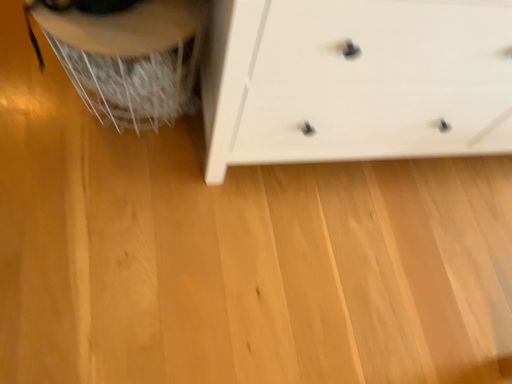
Locate an element on the screen. white matte chest of drawers at center is located at coordinates [355, 80].

Image resolution: width=512 pixels, height=384 pixels. Describe the element at coordinates (355, 80) in the screenshot. I see `white matte chest of drawers at center` at that location.

At what (x,y) coordinates should I click in order to perform the action: click on white plastic swivel chair at left. Please return your answer as a coordinate pair (x, y). Looking at the image, I should click on (x=127, y=55).

What do you see at coordinates (127, 55) in the screenshot?
I see `white plastic swivel chair at left` at bounding box center [127, 55].

Find the location of a particular element. white matte chest of drawers at center is located at coordinates (355, 80).

Which is more to the right, white plastic swivel chair at left or white matte chest of drawers at center?

From the viewer's perspective, white matte chest of drawers at center appears more on the right side.

Is white plastic swivel chair at left positioned before white matte chest of drawers at center?

No, white plastic swivel chair at left is behind white matte chest of drawers at center.

Is point (181, 45) positioned after point (404, 122)?

No.

From the image's perspective, relative to white matte chest of drawers at center, is white plastic swivel chair at left above or below?

Clearly, from the image's perspective, white plastic swivel chair at left is below white matte chest of drawers at center.

From a real-world perspective, is white plastic swivel chair at left above or below white matte chest of drawers at center?

white plastic swivel chair at left is situated lower than white matte chest of drawers at center in the real world.

Consider the image. Does white plastic swivel chair at left have a greater width compared to white matte chest of drawers at center?

In fact, white plastic swivel chair at left might be narrower than white matte chest of drawers at center.

Considering the sizes of white plastic swivel chair at left and white matte chest of drawers at center in the image, is white plastic swivel chair at left taller or shorter than white matte chest of drawers at center?

Clearly, white plastic swivel chair at left is shorter compared to white matte chest of drawers at center.

From the picture: Is white plastic swivel chair at left bigger than white matte chest of drawers at center?

No, white plastic swivel chair at left is not bigger than white matte chest of drawers at center.

Would you say white plastic swivel chair at left contains white matte chest of drawers at center?

No, white matte chest of drawers at center is not a part of white plastic swivel chair at left.

Is the surface of white plastic swivel chair at left in direct contact with white matte chest of drawers at center?

No, white plastic swivel chair at left is not with white matte chest of drawers at center.

Is white plastic swivel chair at left oriented away from white matte chest of drawers at center?

No.

What's the angular difference between white plastic swivel chair at left and white matte chest of drawers at center's facing directions?

The angle between the facing direction of white plastic swivel chair at left and the facing direction of white matte chest of drawers at center is 1.73e-05 degrees.

Identify the location of swivel chair that appears on the left of white matte chest of drawers at center. (127, 55).

Considering the relative positions of white matte chest of drawers at center and white plastic swivel chair at left in the image provided, is white matte chest of drawers at center to the right of white plastic swivel chair at left from the viewer's perspective?

Yes, white matte chest of drawers at center is to the right of white plastic swivel chair at left.

Based on the photo, is white matte chest of drawers at center further to camera compared to white plastic swivel chair at left?

No, white matte chest of drawers at center is closer to the camera.

Does point (252, 72) appear closer or farther from the camera than point (97, 98)?

Clearly, point (252, 72) is closer to the camera than point (97, 98).

From the image's perspective, is white matte chest of drawers at center on white plastic swivel chair at left?

Yes, from the image's perspective, white matte chest of drawers at center is on top of white plastic swivel chair at left.

From a real-world perspective, is white matte chest of drawers at center over white plastic swivel chair at left?

Yes.

Looking at their sizes, would you say white matte chest of drawers at center is wider or thinner than white plastic swivel chair at left?

Clearly, white matte chest of drawers at center has more width compared to white plastic swivel chair at left.

Can you confirm if white matte chest of drawers at center is taller than white plastic swivel chair at left?

Correct, white matte chest of drawers at center is much taller as white plastic swivel chair at left.

Between white matte chest of drawers at center and white plastic swivel chair at left, which one has smaller size?

With smaller size is white plastic swivel chair at left.

Is white matte chest of drawers at center situated inside white plastic swivel chair at left or outside?

white matte chest of drawers at center lies outside white plastic swivel chair at left.

Are white matte chest of drawers at center and white plastic swivel chair at left located far from each other?

No, white matte chest of drawers at center is not far away from white plastic swivel chair at left.

Is white matte chest of drawers at center positioned with its back to white plastic swivel chair at left?

That's not correct — white matte chest of drawers at center is not looking away from white plastic swivel chair at left.

Can you tell me how much white matte chest of drawers at center and white plastic swivel chair at left differ in facing direction?

1.73e-05 degrees.

I want to click on the chest of drawers that appears in front of the white plastic swivel chair at left, so click(355, 80).

Where is `swivel chair located underneath the white matte chest of drawers at center (from a real-world perspective)`? swivel chair located underneath the white matte chest of drawers at center (from a real-world perspective) is located at coordinates coord(127,55).

Identify the location of swivel chair that is behind the white matte chest of drawers at center. (127, 55).